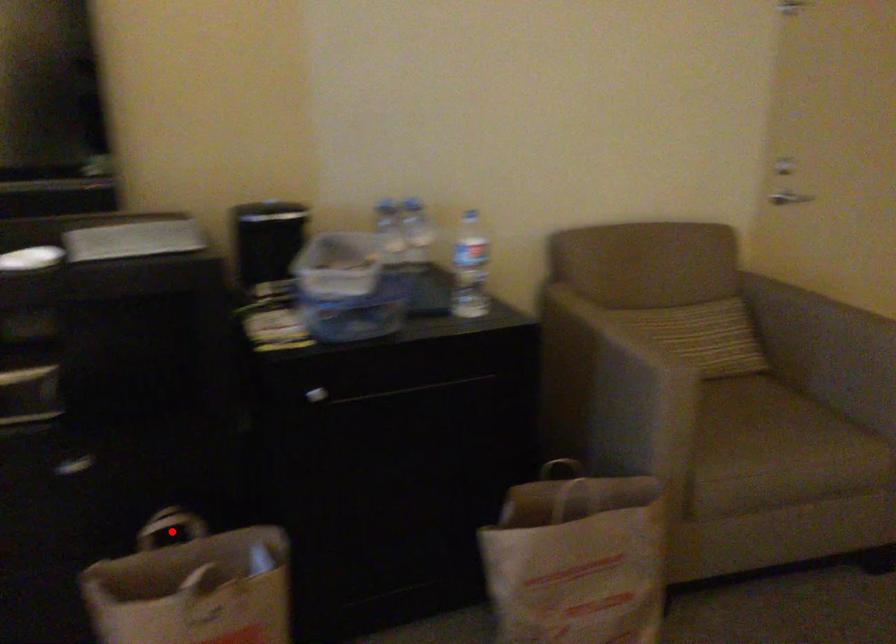
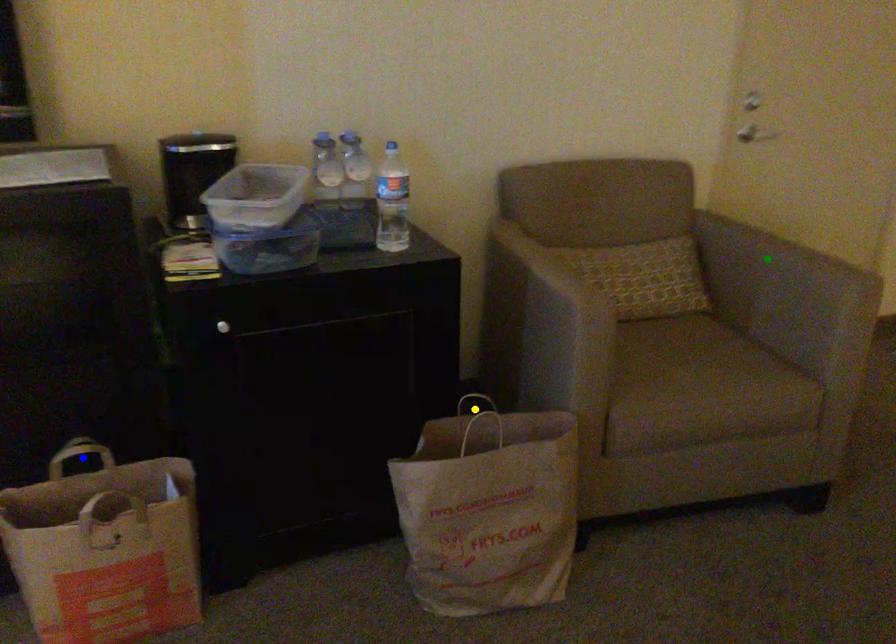
Question: I am providing you with two images of the same scene from different viewpoints. A red point is marked on the first image. You are given multiple points on the second image. Which point in image 2 is actually the same real-world point as the red point in image 1?

Choices:
 (A) blue point
 (B) green point
 (C) yellow point

Answer: (A)